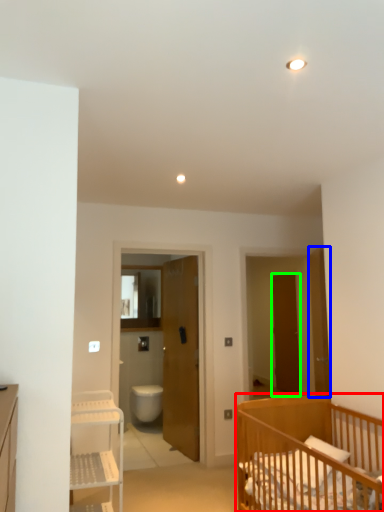
Question: Which object is positioned farthest from infant bed (highlighted by a red box)? Select from door (highlighted by a blue box) and door (highlighted by a green box).

Choices:
 (A) door
 (B) door

Answer: (B)